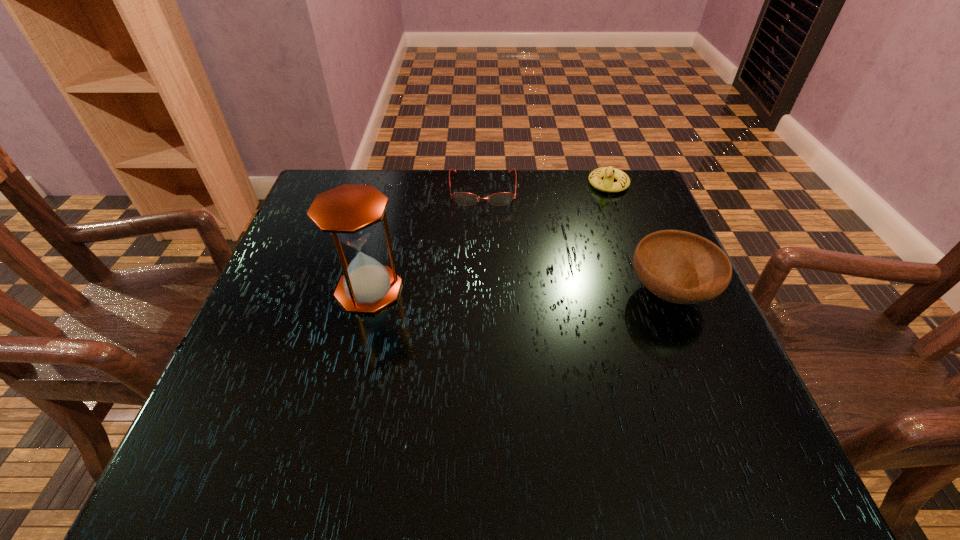
Locate an element on the screen. The height and width of the screenshot is (540, 960). vacant area between the second object from left to right and the duckling is located at coordinates (545, 187).

I want to click on free spot between the second tallest object and the shortest object, so click(x=576, y=241).

Locate an element on the screen. The image size is (960, 540). free spot between the bowl and the shortest object is located at coordinates (576, 241).

This screenshot has height=540, width=960. I want to click on vacant space that is in between the shortest object and the second shortest object, so click(x=545, y=187).

The image size is (960, 540). Find the location of `vacant space in between the leftmost object and the third shortest object`. vacant space in between the leftmost object and the third shortest object is located at coordinates (519, 291).

What are the coordinates of `vacant area that lies between the spectacles and the third tallest object` in the screenshot? It's located at (545, 187).

Point out which object is positioned as the nearest to the hourglass. Please provide its 2D coordinates. Your answer should be formatted as a tuple, i.e. [(x, y)], where the tuple contains the x and y coordinates of a point satisfying the conditions above.

[(463, 198)]

You are a GUI agent. You are given a task and a screenshot of the screen. Output one action in this format:
    pyautogui.click(x=<x>, y=<y>)
    Task: Click on the object that is the third closest to the duckling
    
    Given the screenshot: What is the action you would take?
    pyautogui.click(x=350, y=213)

Where is `free space that satisfies the following two spatial constraints: 1. on the back side of the duckling; 2. on the right side of the spectacles`? This screenshot has height=540, width=960. free space that satisfies the following two spatial constraints: 1. on the back side of the duckling; 2. on the right side of the spectacles is located at coordinates (483, 184).

Locate an element on the screen. free space that satisfies the following two spatial constraints: 1. on the front side of the third shortest object; 2. on the left side of the duckling is located at coordinates (648, 292).